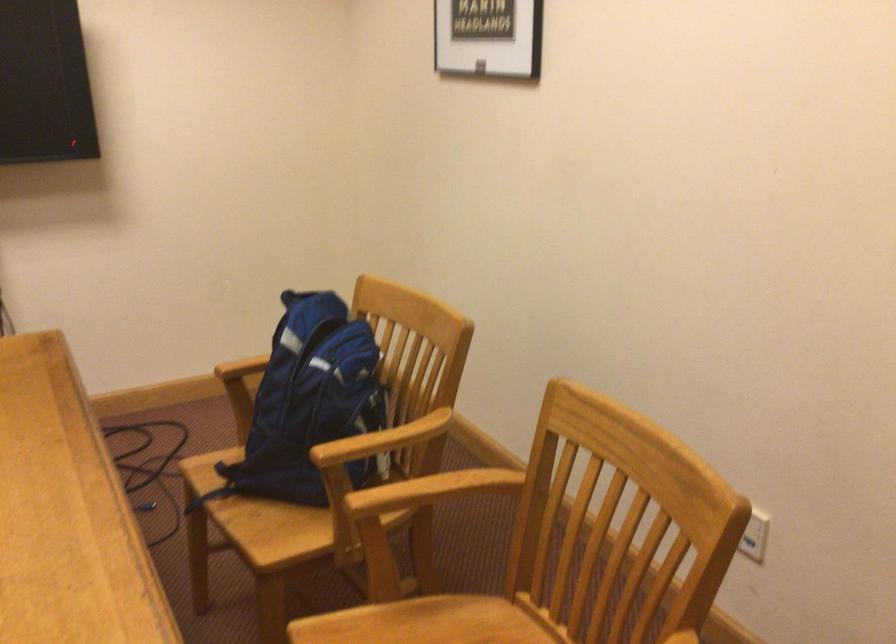
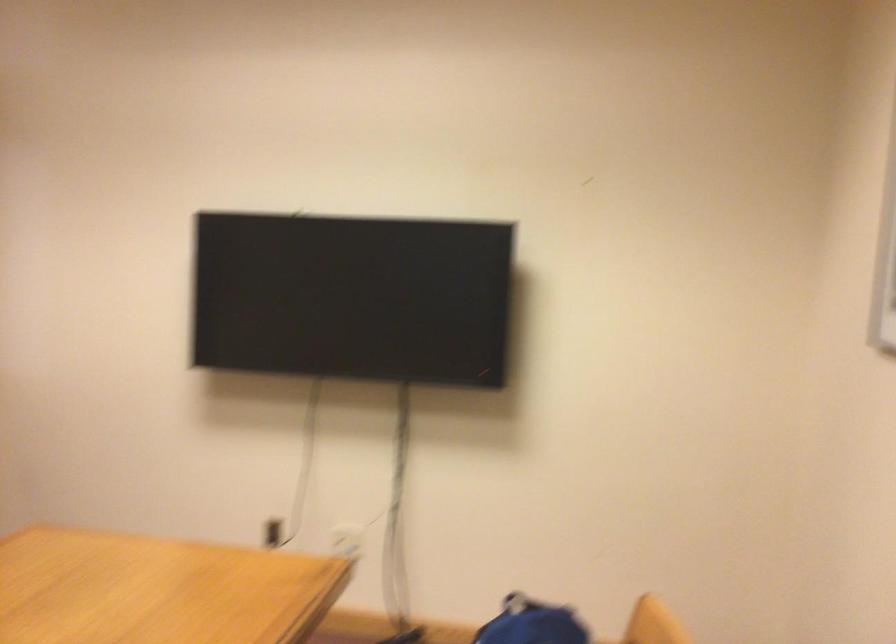
Question: The camera is either moving clockwise (left) or counter-clockwise (right) around the object. The first image is from the beginning of the video and the second image is from the end. Is the camera moving left or right when shooting the video?

Choices:
 (A) Left
 (B) Right

Answer: (B)